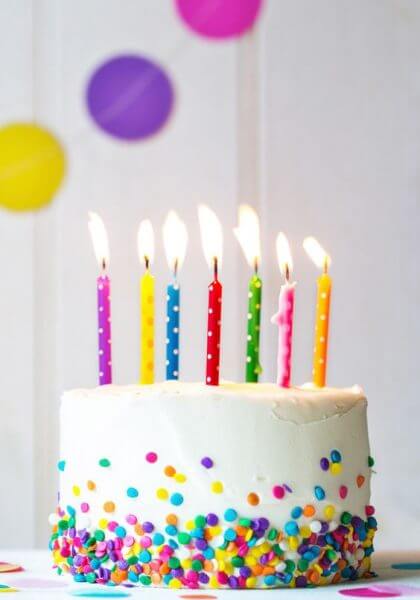
The height and width of the screenshot is (600, 420). Find the location of `birthday candle flames`. birthday candle flames is located at coordinates (101, 241), (149, 249), (176, 245), (209, 245), (248, 247), (285, 260), (319, 255).